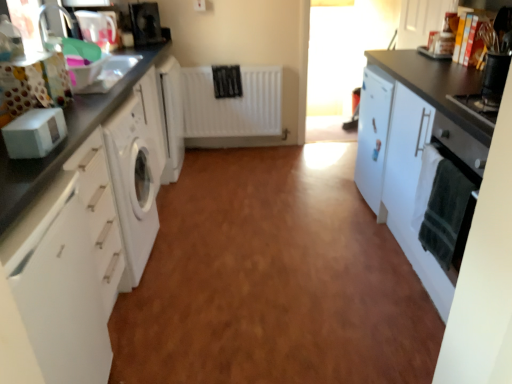
Question: Is white matte cabinet at left, arranged as the second cabinetry when viewed from the left, far away from white glossy jug at upper left, which is the third appliance from bottom to top?

Choices:
 (A) no
 (B) yes

Answer: (B)

Question: From a real-world perspective, does white matte cabinet at left, the 2th cabinetry from the right, sit lower than white glossy jug at upper left, which is counted as the 1th appliance, starting from the left?

Choices:
 (A) no
 (B) yes

Answer: (B)

Question: Could you tell me if white matte cabinet at left, the 2th cabinetry from the right, is facing white glossy jug at upper left, which is the 3th appliance from front to back?

Choices:
 (A) no
 (B) yes

Answer: (A)

Question: Is white matte cabinet at left, the 2th cabinetry from the right, directly adjacent to white glossy jug at upper left, which is the 4th appliance in right-to-left order?

Choices:
 (A) no
 (B) yes

Answer: (A)

Question: Considering the relative sizes of white matte cabinet at left, the 2th cabinetry from the right, and white glossy jug at upper left, which is the third appliance from bottom to top, in the image provided, is white matte cabinet at left, the 2th cabinetry from the right, shorter than white glossy jug at upper left, which is the third appliance from bottom to top,?

Choices:
 (A) no
 (B) yes

Answer: (A)

Question: From a real-world perspective, is white matte cabinet at left, the 2th cabinetry from the right, on white glossy jug at upper left, the second appliance in the back-to-front sequence?

Choices:
 (A) yes
 (B) no

Answer: (B)

Question: Can you confirm if black glossy fan at upper center, acting as the 1th appliance starting from the back, is thinner than white matte cabinet at right, which ranks as the first cabinetry in right-to-left order?

Choices:
 (A) yes
 (B) no

Answer: (A)

Question: Is black glossy fan at upper center, acting as the 1th appliance starting from the back, further to camera compared to white matte cabinet at right, marked as the third cabinetry in a left-to-right arrangement?

Choices:
 (A) yes
 (B) no

Answer: (A)

Question: From a real-world perspective, is black glossy fan at upper center, acting as the 1th appliance starting from the back, below white matte cabinet at right, marked as the third cabinetry in a left-to-right arrangement?

Choices:
 (A) no
 (B) yes

Answer: (A)

Question: Considering the relative sizes of black glossy fan at upper center, placed as the 2th appliance when sorted from left to right, and white matte cabinet at right, marked as the third cabinetry in a left-to-right arrangement, in the image provided, is black glossy fan at upper center, placed as the 2th appliance when sorted from left to right, bigger than white matte cabinet at right, marked as the third cabinetry in a left-to-right arrangement,?

Choices:
 (A) no
 (B) yes

Answer: (A)

Question: Is black glossy fan at upper center, arranged as the fourth appliance when viewed from the front, wider than white matte cabinet at right, which ranks as the first cabinetry in right-to-left order?

Choices:
 (A) yes
 (B) no

Answer: (B)

Question: Are black glossy fan at upper center, arranged as the third appliance when viewed from the right, and white matte cabinet at right, which ranks as the first cabinetry in right-to-left order, far apart?

Choices:
 (A) yes
 (B) no

Answer: (A)

Question: From the image's perspective, would you say white matte cabinet at left, the 2th cabinetry from the right, is positioned over white matte radiator at center?

Choices:
 (A) no
 (B) yes

Answer: (A)